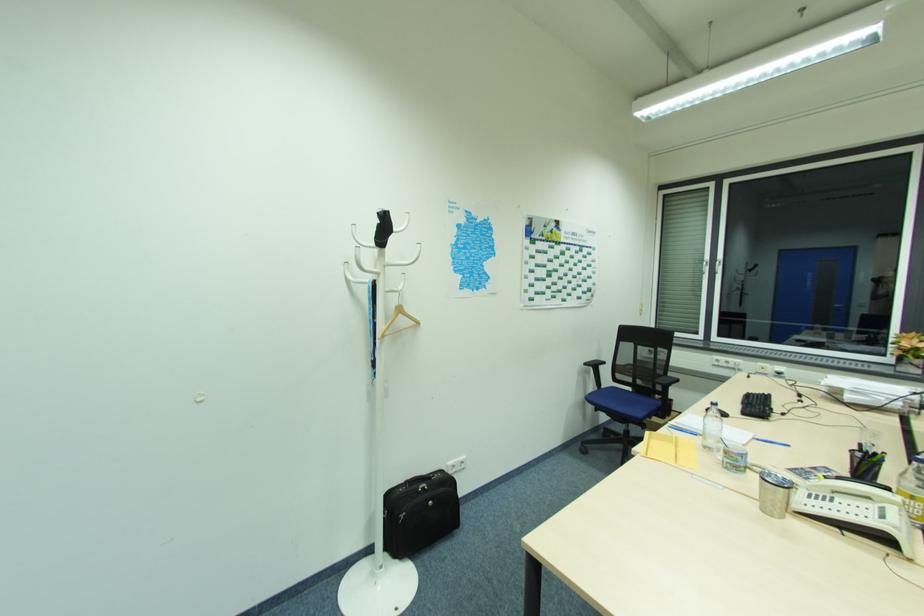
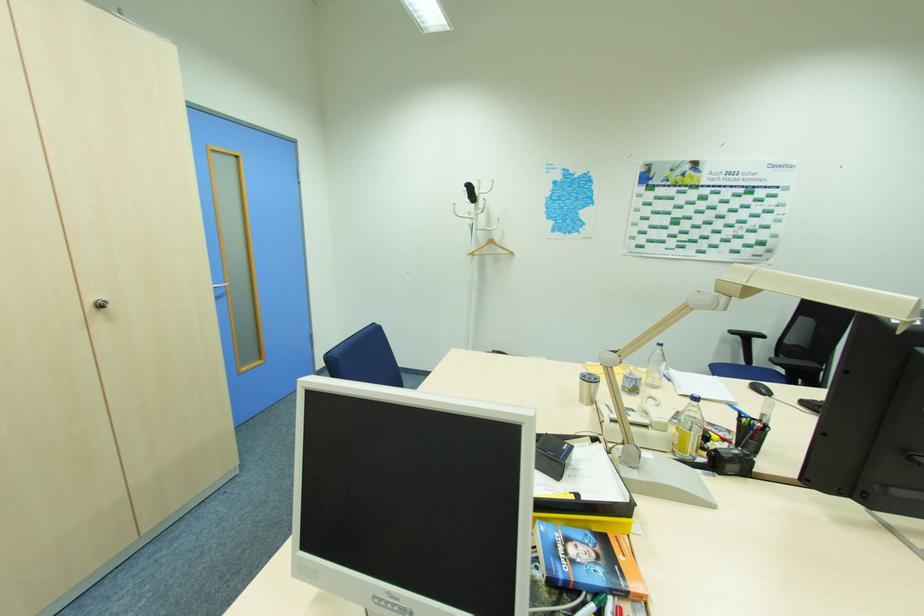
In the second image, find the point that corresponds to (589,365) in the first image.

(734, 331)